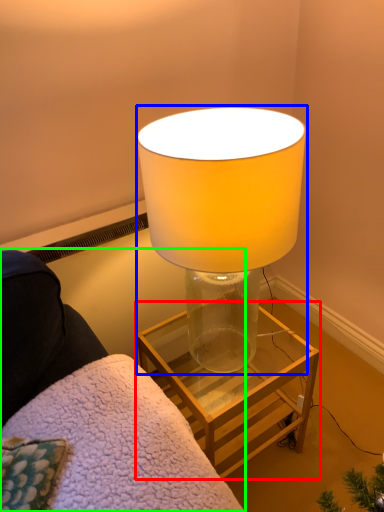
Question: Which object is positioned farthest from table (highlighted by a red box)? Select from lamp (highlighted by a blue box) and furniture (highlighted by a green box).

Choices:
 (A) lamp
 (B) furniture

Answer: (A)